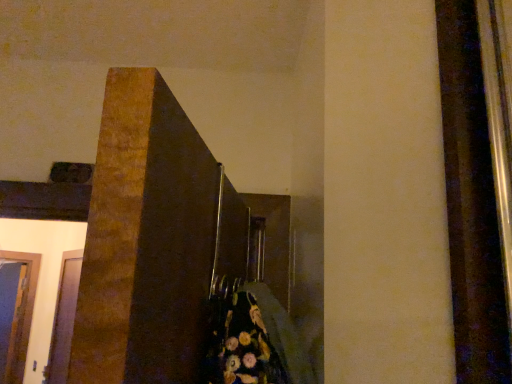
Locate an element on the screen. transparent glass door at lower left, which ranks as the 2th glass door in back-to-front order is located at coordinates (64, 319).

The image size is (512, 384). Describe the element at coordinates (64, 319) in the screenshot. I see `transparent glass door at lower left, positioned as the second glass door in left-to-right order` at that location.

At what (x,y) coordinates should I click in order to perform the action: click on transparent glass door at lower left, which is the second glass door from right to left. Please return your answer as a coordinate pair (x, y). The image size is (512, 384). Looking at the image, I should click on (16, 311).

This screenshot has height=384, width=512. What do you see at coordinates (16, 311) in the screenshot? I see `transparent glass door at lower left, which is the second glass door from right to left` at bounding box center [16, 311].

Measure the distance between point (23, 300) and camera.

Point (23, 300) and camera are 3.86 meters apart.

How much space does transparent glass door at lower left, placed as the 2th glass door when sorted from front to back, occupy vertically?

The height of transparent glass door at lower left, placed as the 2th glass door when sorted from front to back, is 1.14 meters.

How much space does transparent glass door at lower left, which is the second glass door from right to left, occupy horizontally?

transparent glass door at lower left, which is the second glass door from right to left, is 2.84 inches wide.

Where is `transparent glass door at lower left, which is the first glass door from right to left`? This screenshot has width=512, height=384. transparent glass door at lower left, which is the first glass door from right to left is located at coordinates (64, 319).

Which object is positioned more to the right, transparent glass door at lower left, which is the first glass door in front-to-back order, or transparent glass door at lower left, acting as the first glass door starting from the left?

transparent glass door at lower left, which is the first glass door in front-to-back order.

Is transparent glass door at lower left, positioned as the second glass door in left-to-right order, further to the viewer compared to transparent glass door at lower left, the first glass door when ordered from back to front?

No.

Does point (70, 347) come in front of point (39, 258)?

Yes, it is.

From the image's perspective, between transparent glass door at lower left, which is the first glass door from right to left, and transparent glass door at lower left, acting as the first glass door starting from the left, who is located below?

transparent glass door at lower left, acting as the first glass door starting from the left.

From a real-world perspective, is transparent glass door at lower left, positioned as the second glass door in left-to-right order, positioned over transparent glass door at lower left, the first glass door when ordered from back to front, based on gravity?

No.

Between transparent glass door at lower left, positioned as the second glass door in left-to-right order, and transparent glass door at lower left, which is the second glass door from right to left, which one has smaller width?

transparent glass door at lower left, which is the second glass door from right to left.

Does transparent glass door at lower left, which is the first glass door in front-to-back order, have a greater height compared to transparent glass door at lower left, which is the second glass door from right to left?

No.

Considering the sizes of objects transparent glass door at lower left, which is the first glass door in front-to-back order, and transparent glass door at lower left, placed as the 2th glass door when sorted from front to back, in the image provided, who is bigger, transparent glass door at lower left, which is the first glass door in front-to-back order, or transparent glass door at lower left, placed as the 2th glass door when sorted from front to back,?

Bigger between the two is transparent glass door at lower left, which is the first glass door in front-to-back order.

Would you say transparent glass door at lower left, which is the second glass door from right to left, is part of transparent glass door at lower left, which ranks as the 2th glass door in back-to-front order,'s contents?

No, transparent glass door at lower left, which ranks as the 2th glass door in back-to-front order, does not contain transparent glass door at lower left, which is the second glass door from right to left.

Is transparent glass door at lower left, positioned as the second glass door in left-to-right order, not close to transparent glass door at lower left, which is the second glass door from right to left?

No, transparent glass door at lower left, positioned as the second glass door in left-to-right order, is not far away from transparent glass door at lower left, which is the second glass door from right to left.

Is transparent glass door at lower left, positioned as the second glass door in left-to-right order, facing away from transparent glass door at lower left, acting as the first glass door starting from the left?

transparent glass door at lower left, positioned as the second glass door in left-to-right order, is not turned away from transparent glass door at lower left, acting as the first glass door starting from the left.

How different are the orientations of transparent glass door at lower left, which is the first glass door in front-to-back order, and transparent glass door at lower left, the first glass door when ordered from back to front, in degrees?

They differ by 88.6 degrees in their facing directions.

Identify the location of glass door that appears in front of the transparent glass door at lower left, which is the second glass door from right to left. (64, 319).

Considering the relative positions of transparent glass door at lower left, placed as the 2th glass door when sorted from front to back, and transparent glass door at lower left, which ranks as the 2th glass door in back-to-front order, in the image provided, is transparent glass door at lower left, placed as the 2th glass door when sorted from front to back, to the left or to the right of transparent glass door at lower left, which ranks as the 2th glass door in back-to-front order,?

Based on their positions, transparent glass door at lower left, placed as the 2th glass door when sorted from front to back, is located to the left of transparent glass door at lower left, which ranks as the 2th glass door in back-to-front order.

Is transparent glass door at lower left, acting as the first glass door starting from the left, closer to the viewer compared to transparent glass door at lower left, which ranks as the 2th glass door in back-to-front order?

That is False.

Which is behind, point (4, 370) or point (57, 320)?

The point (4, 370) is behind.

Consider the image. From the image's perspective, which is below, transparent glass door at lower left, placed as the 2th glass door when sorted from front to back, or transparent glass door at lower left, which ranks as the 2th glass door in back-to-front order?

From the image's view, transparent glass door at lower left, placed as the 2th glass door when sorted from front to back, is below.

Looking at this image, from a real-world perspective, is transparent glass door at lower left, placed as the 2th glass door when sorted from front to back, beneath transparent glass door at lower left, which is the first glass door in front-to-back order?

No, from a real-world perspective, transparent glass door at lower left, placed as the 2th glass door when sorted from front to back, is not under transparent glass door at lower left, which is the first glass door in front-to-back order.

Which object is wider, transparent glass door at lower left, acting as the first glass door starting from the left, or transparent glass door at lower left, which is the first glass door from right to left?

With larger width is transparent glass door at lower left, which is the first glass door from right to left.

Which of these two, transparent glass door at lower left, acting as the first glass door starting from the left, or transparent glass door at lower left, which is the first glass door in front-to-back order, stands taller?

Standing taller between the two is transparent glass door at lower left, acting as the first glass door starting from the left.

Does transparent glass door at lower left, placed as the 2th glass door when sorted from front to back, have a smaller size compared to transparent glass door at lower left, positioned as the second glass door in left-to-right order?

Yes.

Is transparent glass door at lower left, placed as the 2th glass door when sorted from front to back, outside of transparent glass door at lower left, positioned as the second glass door in left-to-right order?

Yes, transparent glass door at lower left, placed as the 2th glass door when sorted from front to back, is not within transparent glass door at lower left, positioned as the second glass door in left-to-right order.

Can you see transparent glass door at lower left, the first glass door when ordered from back to front, touching transparent glass door at lower left, which is the first glass door in front-to-back order?

transparent glass door at lower left, the first glass door when ordered from back to front, and transparent glass door at lower left, which is the first glass door in front-to-back order, are clearly separated.

Is transparent glass door at lower left, acting as the first glass door starting from the left, facing away from transparent glass door at lower left, which is the first glass door from right to left?

transparent glass door at lower left, acting as the first glass door starting from the left, is not turned away from transparent glass door at lower left, which is the first glass door from right to left.

How many degrees apart are the facing directions of transparent glass door at lower left, which is the second glass door from right to left, and transparent glass door at lower left, which is the first glass door from right to left?

88.6 degrees.

I want to click on glass door above the transparent glass door at lower left, which is the second glass door from right to left (from the image's perspective), so click(x=64, y=319).

This screenshot has height=384, width=512. In order to click on glass door on the right of transparent glass door at lower left, the first glass door when ordered from back to front in this screenshot , I will do `click(64, 319)`.

I want to click on glass door below the transparent glass door at lower left, placed as the 2th glass door when sorted from front to back (from a real-world perspective), so click(64, 319).